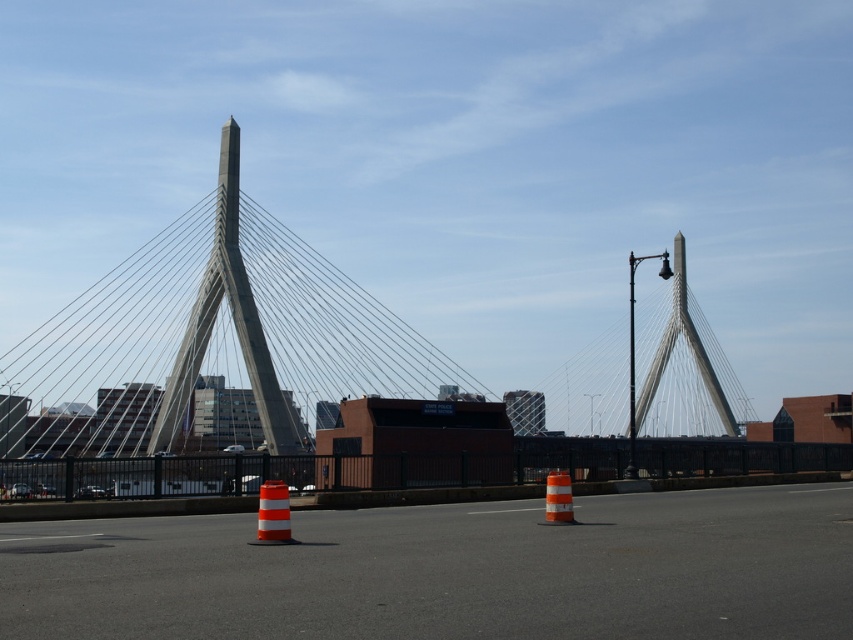
You are a pedestrian standing on the paved road near the orange and white striped cone at center and the orange reflective cone at center. Which cone is closer to you?

The orange and white striped cone at center is closer to you than the orange reflective cone at center.

You are standing at the point marked by the orange and white traffic cones on the road. Looking towards the gray concrete suspension bridge at center, which direction should you face to see the bridge located at point (x=207, y=340)?

The gray concrete suspension bridge at center is located at point (x=207, y=340), so you should face towards the center of the image to see the bridge.